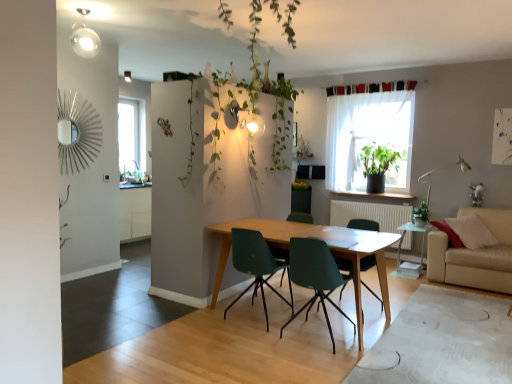
This screenshot has height=384, width=512. What do you see at coordinates (314, 276) in the screenshot? I see `teal plastic chair at center, which is the 2th chair from right to left` at bounding box center [314, 276].

Find the location of `teal plastic chair at center, which is the 2th chair from right to left`. teal plastic chair at center, which is the 2th chair from right to left is located at coordinates (314, 276).

Find the location of a particular element. The width and height of the screenshot is (512, 384). green matte plant at window is located at coordinates (378, 165).

What is the approximate height of transparent glass side table at lower right?

60.79 centimeters.

Where is `transparent glass window at upper left, marked as the first window in a left-to-right arrangement`? transparent glass window at upper left, marked as the first window in a left-to-right arrangement is located at coordinates (132, 136).

Consider the image. How many degrees apart are the facing directions of beige fabric couch at lower right and transparent glass window at upper left, placed as the second window when sorted from right to left?

90 degrees.

Between beige fabric couch at lower right and transparent glass window at upper left, positioned as the first window in back-to-front order, which one has smaller width?

transparent glass window at upper left, positioned as the first window in back-to-front order, is thinner.

Does beige fabric couch at lower right touch transparent glass window at upper left, arranged as the 2th window when viewed from the front?

beige fabric couch at lower right and transparent glass window at upper left, arranged as the 2th window when viewed from the front, are not in contact.

Considering the positions of objects beige fabric couch at lower right and transparent glass window at upper left, positioned as the first window in back-to-front order, in the image provided, who is more to the left, beige fabric couch at lower right or transparent glass window at upper left, positioned as the first window in back-to-front order,?

transparent glass window at upper left, positioned as the first window in back-to-front order, is more to the left.

Considering the relative sizes of transparent glass window at upper left, arranged as the 2th window when viewed from the front, and beige fabric couch at lower right in the image provided, is transparent glass window at upper left, arranged as the 2th window when viewed from the front, shorter than beige fabric couch at lower right?

No.

Is transparent glass window at upper left, arranged as the 2th window when viewed from the front, at the right side of beige fabric couch at lower right?

Incorrect, transparent glass window at upper left, arranged as the 2th window when viewed from the front, is not on the right side of beige fabric couch at lower right.

Find the location of a particular element. The image size is (512, 384). studio couch to the right of transparent glass window at upper left, positioned as the first window in back-to-front order is located at coordinates (474, 255).

Based on the photo, is transparent glass window at upper left, marked as the first window in a left-to-right arrangement, thinner than beige fabric couch at lower right?

Indeed, transparent glass window at upper left, marked as the first window in a left-to-right arrangement, has a lesser width compared to beige fabric couch at lower right.

Is transparent glass window at upper left, arranged as the 2th window when viewed from the front, beside green leafy plant at right?

No, transparent glass window at upper left, arranged as the 2th window when viewed from the front, is not touching green leafy plant at right.

How different are the orientations of transparent glass window at upper left, marked as the first window in a left-to-right arrangement, and green leafy plant at right in degrees?

The facing directions of transparent glass window at upper left, marked as the first window in a left-to-right arrangement, and green leafy plant at right are 89.1 degrees apart.

Is transparent glass window at upper left, positioned as the first window in back-to-front order, closer to camera compared to green leafy plant at right?

No, transparent glass window at upper left, positioned as the first window in back-to-front order, is further to the viewer.

Does transparent glass window at upper left, positioned as the first window in back-to-front order, have a greater width compared to green leafy plant at right?

In fact, transparent glass window at upper left, positioned as the first window in back-to-front order, might be narrower than green leafy plant at right.

Between matte green chair at center, the 2th chair from the left, and green matte plant at window, which one has smaller width?

green matte plant at window.

From a real-world perspective, who is located higher, matte green chair at center, placed as the 3th chair when sorted from right to left, or green matte plant at window?

green matte plant at window.

From the picture: Can we say matte green chair at center, placed as the 3th chair when sorted from right to left, lies outside green matte plant at window?

Absolutely, matte green chair at center, placed as the 3th chair when sorted from right to left, is external to green matte plant at window.

Considering the relative sizes of green matte plant at window and green leafy plant at right in the image provided, is green matte plant at window thinner than green leafy plant at right?

Incorrect, the width of green matte plant at window is not less than that of green leafy plant at right.

From a real-world perspective, is green matte plant at window under green leafy plant at right?

No.

In the image, is green matte plant at window on the left side or the right side of green leafy plant at right?

green matte plant at window is positioned on green leafy plant at right's left side.

Would you say green leafy plant at right is to the left or to the right of matte green chair at center, acting as the fourth chair starting from the left, in the picture?

green leafy plant at right is positioned on matte green chair at center, acting as the fourth chair starting from the left,'s right side.

Which of these two, green leafy plant at right or matte green chair at center, positioned as the first chair in right-to-left order, is bigger?

With larger size is matte green chair at center, positioned as the first chair in right-to-left order.

Between green leafy plant at right and matte green chair at center, acting as the fourth chair starting from the left, which one is positioned in front?

matte green chair at center, acting as the fourth chair starting from the left, is in front.

In the scene shown: Is green leafy plant at right with matte green chair at center, positioned as the first chair in right-to-left order?

No, green leafy plant at right is not next to matte green chair at center, positioned as the first chair in right-to-left order.

Does teal plastic chair at center, acting as the third chair starting from the left, appear on the right side of matte green plastic chair at center, placed as the first chair when sorted from left to right?

Yes.

Considering the sizes of teal plastic chair at center, acting as the third chair starting from the left, and matte green plastic chair at center, which is the fourth chair from right to left, in the image, is teal plastic chair at center, acting as the third chair starting from the left, taller or shorter than matte green plastic chair at center, which is the fourth chair from right to left,?

Considering their sizes, teal plastic chair at center, acting as the third chair starting from the left, has more height than matte green plastic chair at center, which is the fourth chair from right to left.

From a real-world perspective, is teal plastic chair at center, acting as the third chair starting from the left, positioned above or below matte green plastic chair at center, placed as the first chair when sorted from left to right?

Clearly, from a real-world perspective, teal plastic chair at center, acting as the third chair starting from the left, is above matte green plastic chair at center, placed as the first chair when sorted from left to right.

Consider the image. Is the surface of teal plastic chair at center, which is the 2th chair from right to left, in direct contact with matte green plastic chair at center, placed as the first chair when sorted from left to right?

No, teal plastic chair at center, which is the 2th chair from right to left, is not touching matte green plastic chair at center, placed as the first chair when sorted from left to right.

Where is `studio couch in front of the transparent glass window at upper left, placed as the second window when sorted from right to left`? studio couch in front of the transparent glass window at upper left, placed as the second window when sorted from right to left is located at coordinates (474, 255).

Identify the location of the 2nd window behind the beige fabric couch at lower right, starting your count from the anchor. This screenshot has width=512, height=384. (132, 136).

From the image, which object appears to be nearer to translucent fabric at upper right, the 2th window viewed from the back, teal plastic chair at center, which is the 2th chair from right to left, or white matte radiator at center?

Among the two, white matte radiator at center is located nearer to translucent fabric at upper right, the 2th window viewed from the back.

Estimate the real-world distances between objects in this image. Which object is closer to transparent glass window at upper left, positioned as the first window in back-to-front order, wooden table at center or white matte radiator at center?

The object closer to transparent glass window at upper left, positioned as the first window in back-to-front order, is white matte radiator at center.

Which object lies further to the anchor point white matte radiator at center, translucent fabric at upper right, the 1th window from the front, or transparent glass window at upper left, positioned as the first window in back-to-front order?

transparent glass window at upper left, positioned as the first window in back-to-front order, is positioned further to the anchor white matte radiator at center.

Which object lies further to the anchor point transparent glass window at upper left, marked as the first window in a left-to-right arrangement, transparent glass side table at lower right or green leafy plant at right?

Among the two, green leafy plant at right is located further to transparent glass window at upper left, marked as the first window in a left-to-right arrangement.

Looking at the image, which one is located further to teal plastic chair at center, which is the 2th chair from right to left, wooden table at center or matte green plastic chair at center, which is the fourth chair from right to left?

wooden table at center is further to teal plastic chair at center, which is the 2th chair from right to left.

From the image, which object appears to be nearer to matte green plastic chair at center, which is the fourth chair from right to left, beige fabric couch at lower right or teal plastic chair at center, which is the 2th chair from right to left?

teal plastic chair at center, which is the 2th chair from right to left, is positioned closer to the anchor matte green plastic chair at center, which is the fourth chair from right to left.

Estimate the real-world distances between objects in this image. Which object is closer to matte green chair at center, acting as the fourth chair starting from the left, teal plastic chair at center, which is the 2th chair from right to left, or beige fabric couch at lower right?

teal plastic chair at center, which is the 2th chair from right to left, is positioned closer to the anchor matte green chair at center, acting as the fourth chair starting from the left.

Considering their positions, is matte green plastic chair at center, which is the fourth chair from right to left, positioned closer to transparent glass side table at lower right than teal plastic chair at center, acting as the third chair starting from the left?

teal plastic chair at center, acting as the third chair starting from the left, lies closer to transparent glass side table at lower right than the other object.

The width and height of the screenshot is (512, 384). Identify the location of chair between matte green chair at center, positioned as the first chair in right-to-left order, and transparent glass window at upper left, marked as the first window in a left-to-right arrangement, in the front-back direction. (x=280, y=255).

Where is `side table positioned between wooden table at center and white matte radiator at center from near to far`? side table positioned between wooden table at center and white matte radiator at center from near to far is located at coordinates (412, 231).

You are a GUI agent. You are given a task and a screenshot of the screen. Output one action in this format:
    pyautogui.click(x=<x>, y=<y>)
    Task: Click on the radiator between matte green chair at center, acting as the fourth chair starting from the left, and green matte plant at window from front to back
    The image size is (512, 384).
    Given the screenshot: What is the action you would take?
    pyautogui.click(x=371, y=214)

Locate an element on the screen. The width and height of the screenshot is (512, 384). table between teal plastic chair at center, acting as the third chair starting from the left, and matte green chair at center, acting as the fourth chair starting from the left, in the front-back direction is located at coordinates (327, 244).